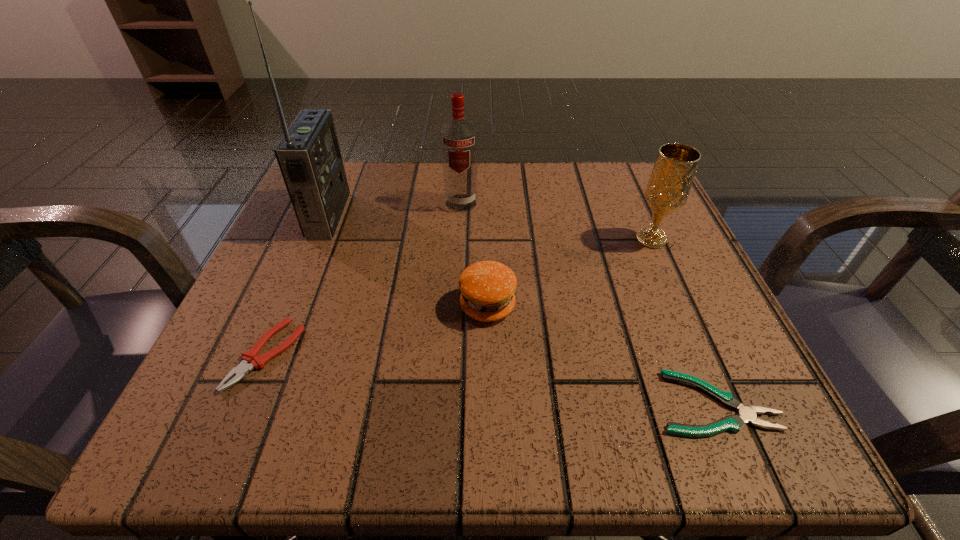
The height and width of the screenshot is (540, 960). Find the location of `object present at the far left corner`. object present at the far left corner is located at coordinates (308, 155).

I want to click on object that is at the near left corner, so click(x=250, y=359).

Where is `object that is positioned at the near right corner`? The height and width of the screenshot is (540, 960). object that is positioned at the near right corner is located at coordinates (747, 414).

This screenshot has height=540, width=960. In the image, there is a desktop. What are the coordinates of `free space at the far edge` in the screenshot? It's located at (534, 226).

In the image, there is a desktop. At what (x,y) coordinates should I click in order to perform the action: click on vacant region at the near edge. Please return your answer as a coordinate pair (x, y). This screenshot has width=960, height=540. Looking at the image, I should click on (624, 410).

Locate an element on the screen. The width and height of the screenshot is (960, 540). free location at the left edge is located at coordinates (266, 294).

The height and width of the screenshot is (540, 960). In order to click on blank space at the right edge in this screenshot , I will do `click(683, 288)`.

In the image, there is a desktop. What are the coordinates of `vacant area at the near left corner` in the screenshot? It's located at (256, 398).

Identify the location of vacant area at the far right corner. (584, 167).

At what (x,y) coordinates should I click in order to perform the action: click on vacant region between the taller pliers and the right pliers. Please return your answer as a coordinate pair (x, y). Image resolution: width=960 pixels, height=540 pixels. Looking at the image, I should click on (491, 379).